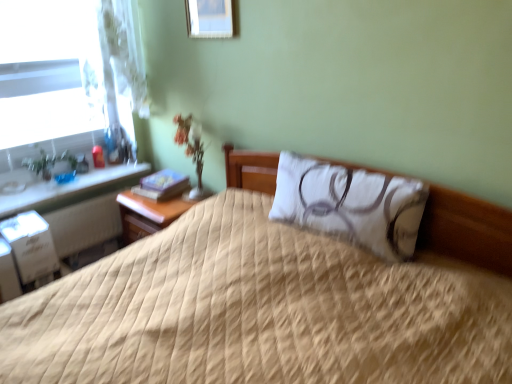
Question: Are wooden picture frame at upper center and green glossy plant at left far apart?

Choices:
 (A) yes
 (B) no

Answer: (A)

Question: From the image's perspective, would you say wooden picture frame at upper center is positioned over green glossy plant at left?

Choices:
 (A) yes
 (B) no

Answer: (A)

Question: Is wooden picture frame at upper center directly adjacent to green glossy plant at left?

Choices:
 (A) yes
 (B) no

Answer: (B)

Question: Could you tell me if wooden picture frame at upper center is turned towards green glossy plant at left?

Choices:
 (A) yes
 (B) no

Answer: (B)

Question: Can you confirm if wooden picture frame at upper center is bigger than green glossy plant at left?

Choices:
 (A) yes
 (B) no

Answer: (B)

Question: Does wooden picture frame at upper center lie behind green glossy plant at left?

Choices:
 (A) yes
 (B) no

Answer: (B)

Question: Considering the relative sizes of green glossy plant at left and beige quilted bed at center in the image provided, is green glossy plant at left wider than beige quilted bed at center?

Choices:
 (A) yes
 (B) no

Answer: (B)

Question: Is green glossy plant at left at the left side of beige quilted bed at center?

Choices:
 (A) yes
 (B) no

Answer: (A)

Question: From the image's perspective, is green glossy plant at left under beige quilted bed at center?

Choices:
 (A) yes
 (B) no

Answer: (B)

Question: Is green glossy plant at left taller than beige quilted bed at center?

Choices:
 (A) no
 (B) yes

Answer: (A)

Question: Does green glossy plant at left have a lesser height compared to beige quilted bed at center?

Choices:
 (A) no
 (B) yes

Answer: (B)

Question: Is beige quilted bed at center located within green glossy plant at left?

Choices:
 (A) no
 (B) yes

Answer: (A)

Question: Considering the relative sizes of wooden picture frame at upper center and clear glass window at left in the image provided, is wooden picture frame at upper center taller than clear glass window at left?

Choices:
 (A) yes
 (B) no

Answer: (B)